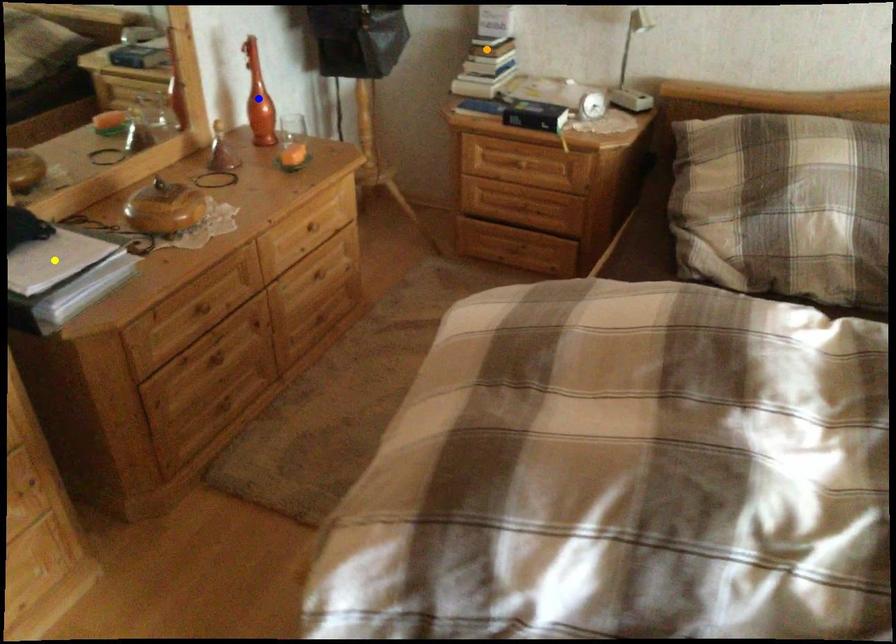
Consider the image. Order these from farthest to nearest:
1. blue point
2. yellow point
3. orange point

orange point, blue point, yellow point